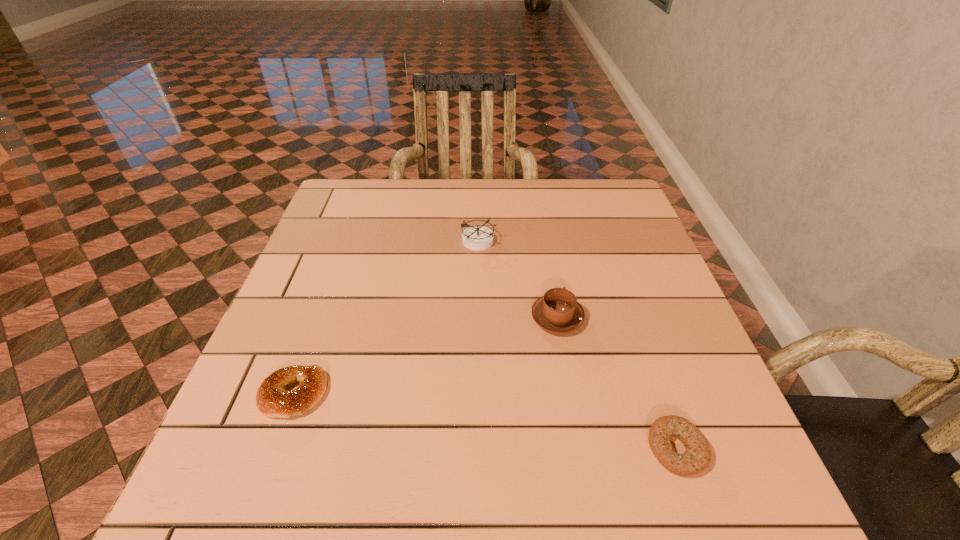
Identify the location of vacant region located 0.210m on the right of the left bagel. This screenshot has height=540, width=960. (439, 394).

Locate an element on the screen. This screenshot has width=960, height=540. vacant region located 0.090m on the back of the right bagel is located at coordinates (652, 379).

The width and height of the screenshot is (960, 540). In order to click on object that is at the near edge in this screenshot , I will do `click(696, 458)`.

Locate an element on the screen. The image size is (960, 540). object that is positioned at the left edge is located at coordinates (272, 399).

Locate an element on the screen. Image resolution: width=960 pixels, height=540 pixels. object located in the right edge section of the desktop is located at coordinates (696, 458).

Where is `object at the near right corner`? The width and height of the screenshot is (960, 540). object at the near right corner is located at coordinates (696, 458).

You are a GUI agent. You are given a task and a screenshot of the screen. Output one action in this format:
    pyautogui.click(x=<x>, y=<y>)
    Task: Click on the free spot at the far edge of the desktop
    
    Given the screenshot: What is the action you would take?
    pyautogui.click(x=563, y=210)

This screenshot has width=960, height=540. What are the coordinates of `blank space at the near edge of the desktop` in the screenshot? It's located at (553, 521).

Find the location of a particular element. Image resolution: width=960 pixels, height=540 pixels. free space at the left edge is located at coordinates (295, 312).

Where is `vacant space at the right edge of the desktop`? vacant space at the right edge of the desktop is located at coordinates (639, 255).